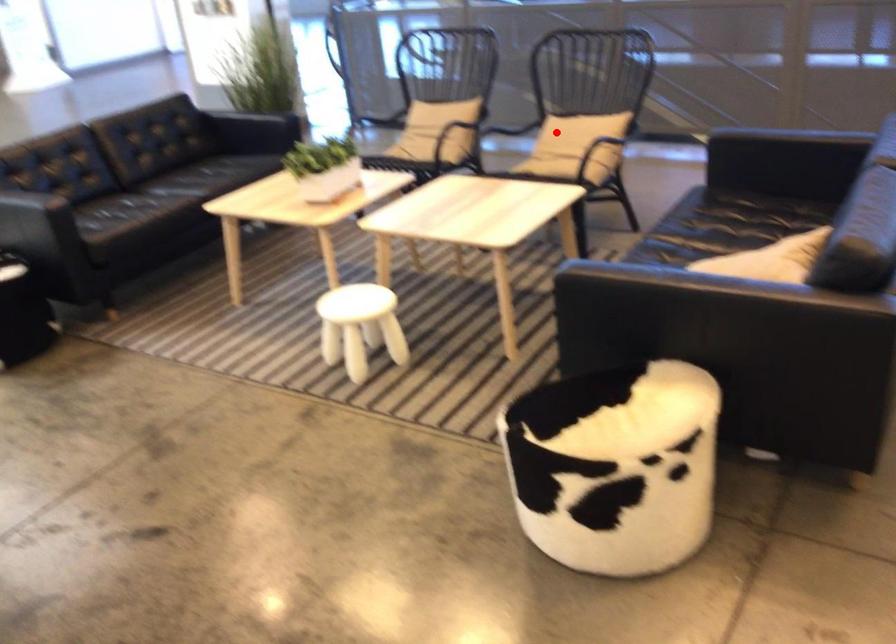
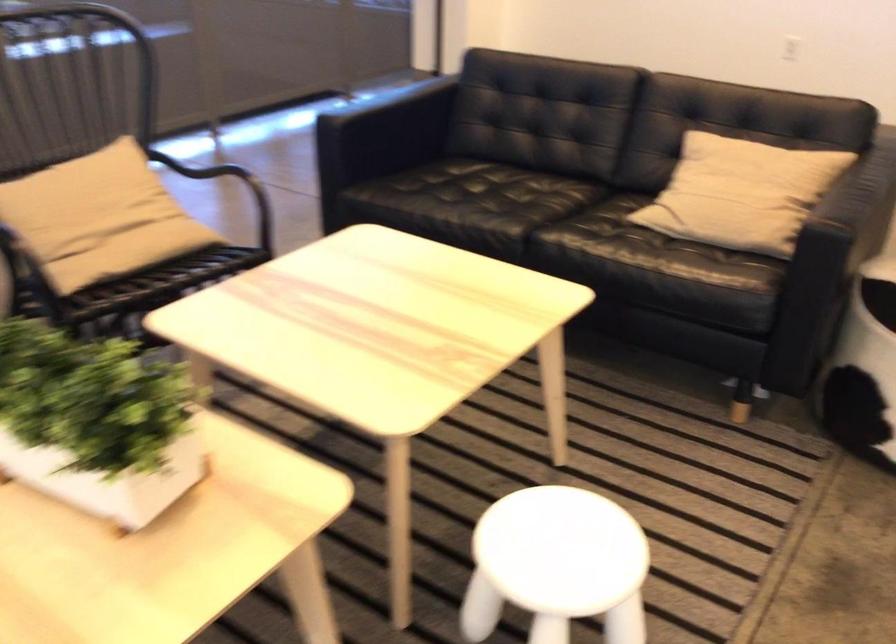
Find the pixel in the second image that matches the highlighted location in the first image.

(99, 214)